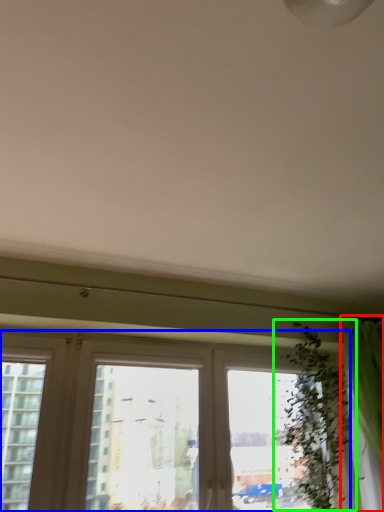
Question: Which is farther away from curtain (highlighted by a red box)? window (highlighted by a blue box) or vegetation (highlighted by a green box)?

Choices:
 (A) window
 (B) vegetation

Answer: (A)